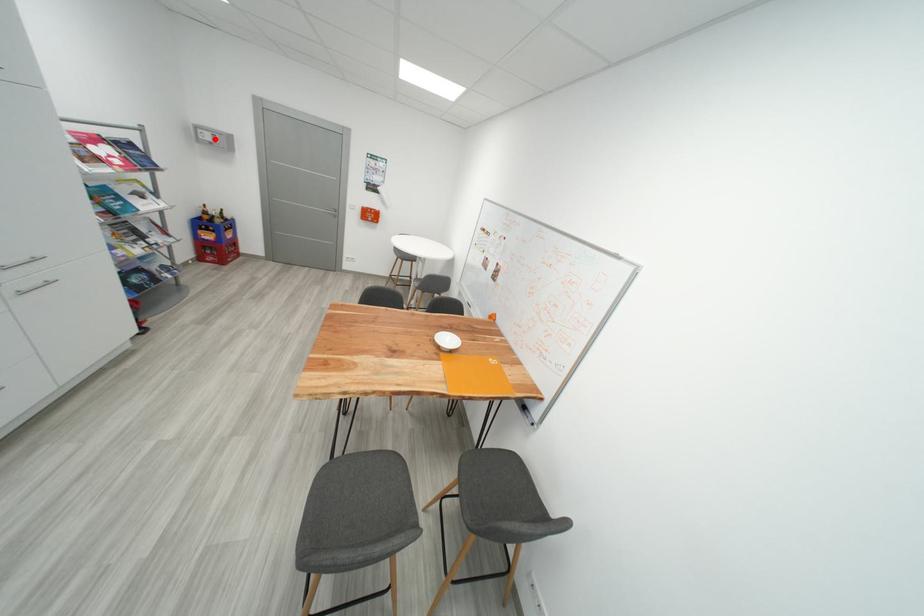
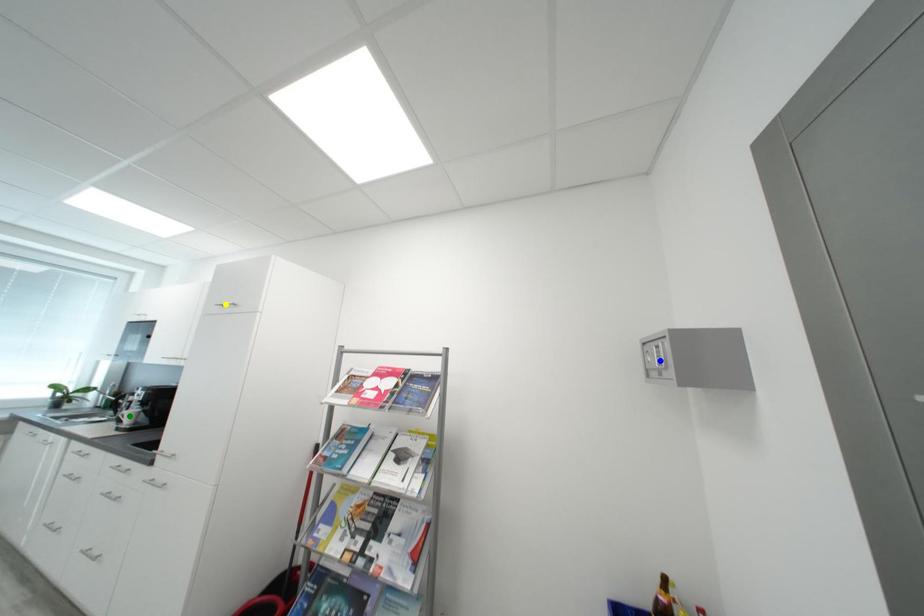
Question: I am providing you with two images of the same scene from different viewpoints. A red point is marked on the first image. You are given multiple points on the second image. Which mark in image 2 goes with the point in image 1?

Choices:
 (A) green point
 (B) yellow point
 (C) blue point

Answer: (C)